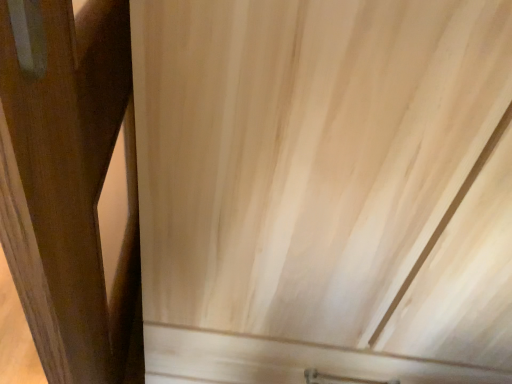
The width and height of the screenshot is (512, 384). Identify the location of dark brown wood door at left. (72, 185).

Describe the element at coordinates (72, 185) in the screenshot. The image size is (512, 384). I see `dark brown wood door at left` at that location.

This screenshot has width=512, height=384. In order to click on dark brown wood door at left in this screenshot , I will do `click(72, 185)`.